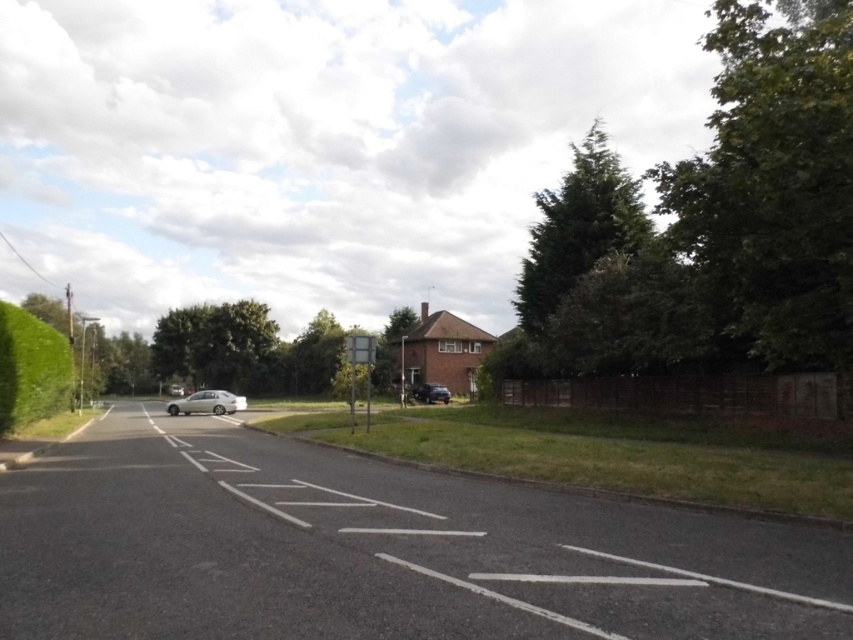
Question: Can you confirm if green leafy tree at center is bigger than shiny black car at center?

Choices:
 (A) yes
 (B) no

Answer: (A)

Question: Does silver metallic car at center come behind silver metallic car at center-left?

Choices:
 (A) no
 (B) yes

Answer: (A)

Question: Which point is closer to the camera taking this photo?

Choices:
 (A) (379, 333)
 (B) (583, 148)
 (C) (171, 394)
 (D) (132, 365)

Answer: (A)

Question: Which of these objects is positioned farthest from the silver metallic car at center?

Choices:
 (A) green leafy tree at center
 (B) green leafy tree at left
 (C) green leafy hedge at left
 (D) silver metallic car at center-left

Answer: (A)

Question: Considering the relative positions of green leafy tree at center and metallic gray street sign at center in the image provided, where is green leafy tree at center located with respect to metallic gray street sign at center?

Choices:
 (A) below
 (B) above

Answer: (B)

Question: Which point is farther to the camera?

Choices:
 (A) shiny black car at center
 (B) silver metallic car at center
 (C) metallic gray street sign at center
 (D) green leafy tree at left

Answer: (D)